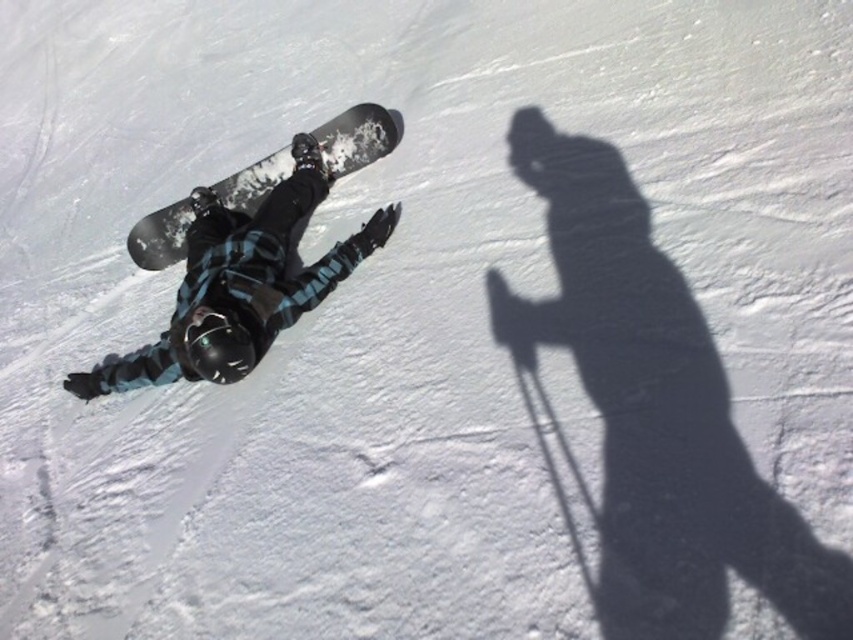
Question: From the image, what is the correct spatial relationship of matte black snowboard at center in relation to black matte snowboard at center?

Choices:
 (A) above
 (B) below

Answer: (B)

Question: Which object is closer to the camera taking this photo?

Choices:
 (A) black matte snowboard at center
 (B) matte black snowboard at center

Answer: (B)

Question: In this image, where is matte black snowboard at center located relative to black matte snowboard at center?

Choices:
 (A) above
 (B) below

Answer: (B)

Question: Among these objects, which one is farthest from the camera?

Choices:
 (A) black matte snowboard at center
 (B) matte black snowboard at center

Answer: (A)

Question: Can you confirm if matte black snowboard at center is positioned to the right of black matte snowboard at center?

Choices:
 (A) no
 (B) yes

Answer: (A)

Question: Which point is closer to the camera?

Choices:
 (A) (335, 156)
 (B) (274, 332)

Answer: (B)